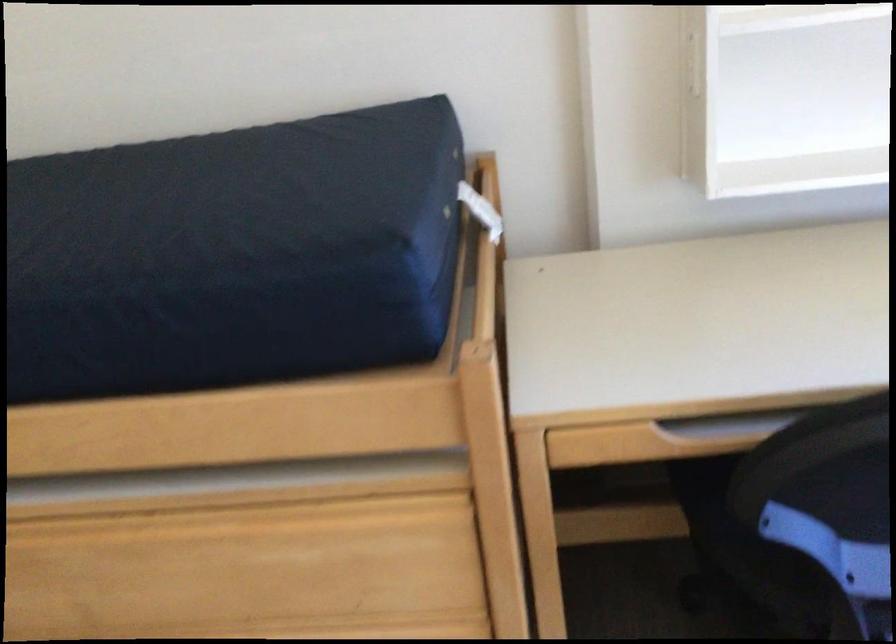
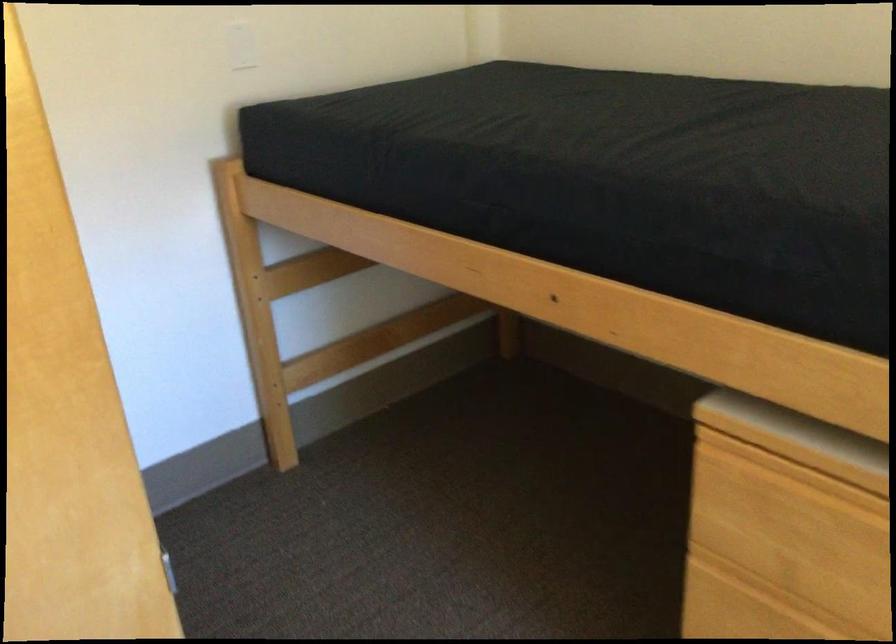
Locate, in the second image, the point that corresponds to (97,516) in the first image.

(837, 474)